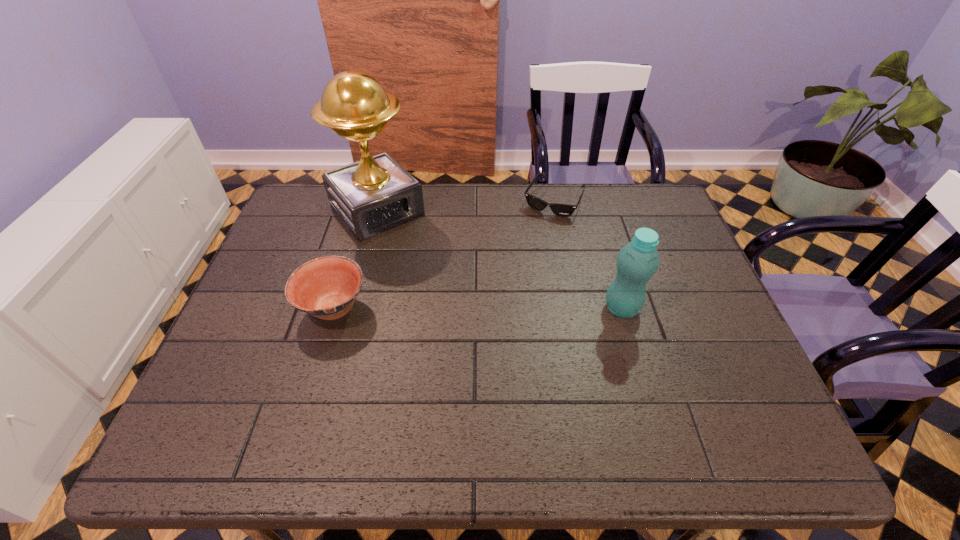
Image resolution: width=960 pixels, height=540 pixels. I want to click on free spot between the third tallest object and the second tallest object, so click(477, 308).

Identify the location of blank region between the water bottle and the shortest object. (588, 254).

At what (x,y) coordinates should I click in order to perform the action: click on empty space that is in between the tallest object and the third tallest object. Please return your answer as a coordinate pair (x, y). The height and width of the screenshot is (540, 960). Looking at the image, I should click on (355, 259).

Where is `the third closest object to the third shortest object`? Image resolution: width=960 pixels, height=540 pixels. the third closest object to the third shortest object is located at coordinates (326, 287).

You are a GUI agent. You are given a task and a screenshot of the screen. Output one action in this format:
    pyautogui.click(x=<x>, y=<y>)
    Task: Click on the object that is the second closest to the tallest object
    The width and height of the screenshot is (960, 540).
    Given the screenshot: What is the action you would take?
    pyautogui.click(x=564, y=210)

In order to click on vacant space that satisfies the following two spatial constraints: 1. on the back side of the shortest object; 2. on the right side of the bowl in this screenshot , I will do `click(366, 200)`.